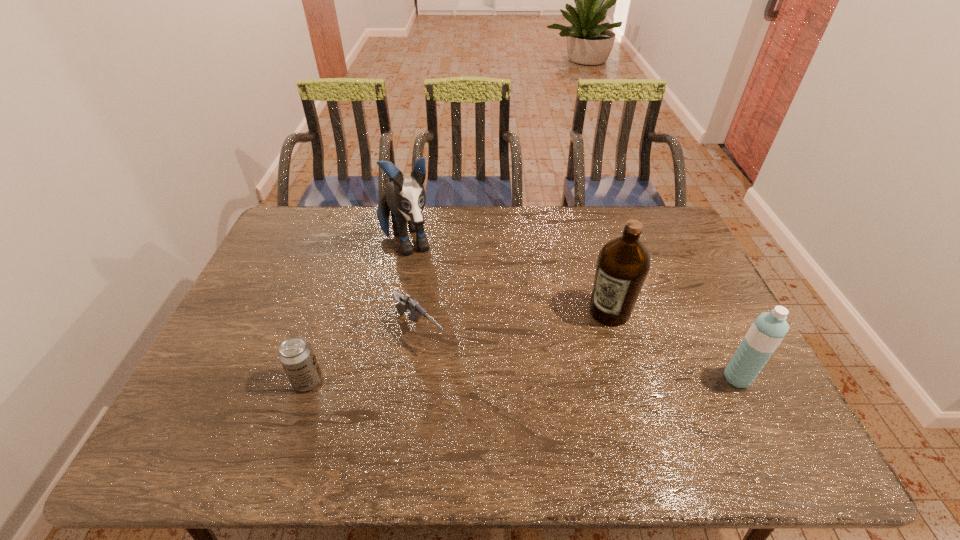
Locate an element on the screen. free location located 0.180m on the back of the rightmost object is located at coordinates (707, 316).

Find the location of a particular element. This screenshot has height=540, width=960. vacant space located 0.100m on the front-facing side of the tallest object is located at coordinates (420, 293).

This screenshot has width=960, height=540. I want to click on vacant space situated on the front-facing side of the tallest object, so (x=437, y=333).

The height and width of the screenshot is (540, 960). What are the coordinates of `vacant space located 0.160m on the front-facing side of the tallest object` in the screenshot? It's located at (426, 306).

I want to click on free location located 0.110m at the barrel of the gun, so click(x=463, y=376).

You are a GUI agent. You are given a task and a screenshot of the screen. Output one action in this format:
    pyautogui.click(x=<x>, y=<y>)
    Task: Click on the free space located at the barrel of the gun
    This screenshot has width=960, height=540.
    Given the screenshot: What is the action you would take?
    pyautogui.click(x=455, y=369)

At what (x,y) coordinates should I click in order to perform the action: click on free space located at the barrel of the gun. Please return your answer as a coordinate pair (x, y). This screenshot has width=960, height=540. Looking at the image, I should click on (448, 362).

This screenshot has width=960, height=540. I want to click on free space located 0.050m on the label of the second object from right to left, so click(589, 335).

The image size is (960, 540). Identify the location of vacant region located 0.380m on the label of the second object from right to left. (519, 418).

The height and width of the screenshot is (540, 960). Find the location of `vacant space located 0.140m on the label of the second object from right to left`. vacant space located 0.140m on the label of the second object from right to left is located at coordinates (572, 355).